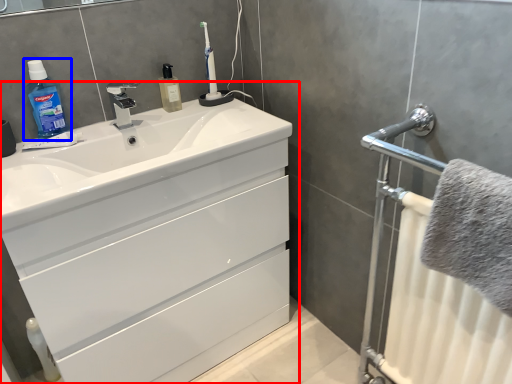
Question: Which object appears closest to the camera in this image, bathroom cabinet (highlighted by a red box) or cleaning product (highlighted by a blue box)?

Choices:
 (A) bathroom cabinet
 (B) cleaning product

Answer: (A)